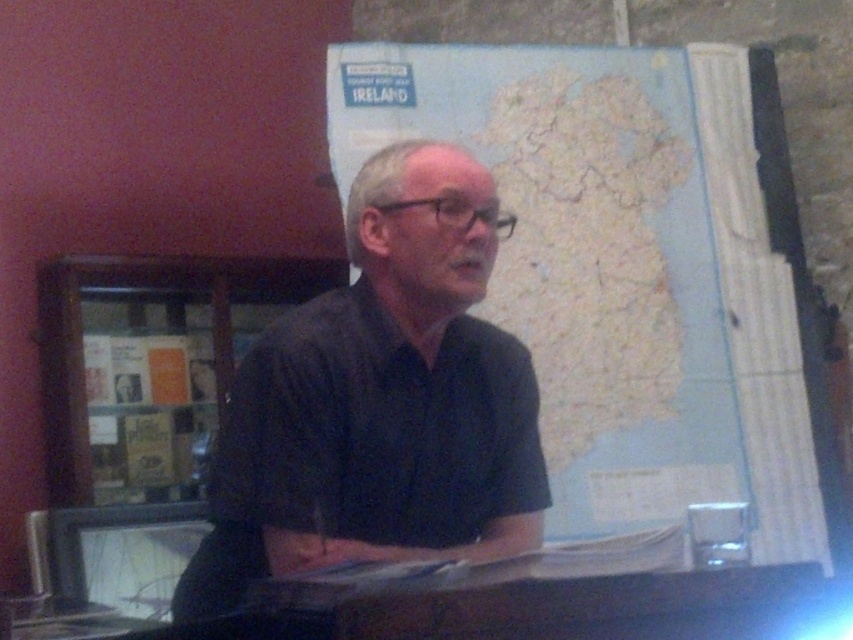
Based on the photo, does light blue paper map at upper center have a greater width compared to matte plastic computer screen at lower left?

Yes, light blue paper map at upper center is wider than matte plastic computer screen at lower left.

Between light blue paper map at upper center and matte plastic computer screen at lower left, which one has less height?

matte plastic computer screen at lower left

Is point (815, 458) in front of point (141, 538)?

Yes, point (815, 458) is closer to viewer.

At what (x,y) coordinates should I click in order to perform the action: click on light blue paper map at upper center. Please return your answer as a coordinate pair (x, y). Looking at the image, I should click on (634, 269).

Is light blue paper map at upper center shorter than black matte shirt at center?

No, light blue paper map at upper center is not shorter than black matte shirt at center.

Is point (654, 452) positioned in front of point (265, 480)?

No, (654, 452) is behind (265, 480).

Between point (712, 72) and point (451, 419), which one is positioned in front?

Point (451, 419) is in front.

Find the location of a particular element. light blue paper map at upper center is located at coordinates (634, 269).

Is wooden frame at upper left to the left of matte plastic computer screen at lower left from the viewer's perspective?

Indeed, wooden frame at upper left is positioned on the left side of matte plastic computer screen at lower left.

Is wooden frame at upper left positioned in front of matte plastic computer screen at lower left?

No, it is not.

Is point (70, 316) positioned after point (160, 544)?

Yes, it is behind point (160, 544).

In order to click on wooden frame at upper left in this screenshot , I will do `click(149, 364)`.